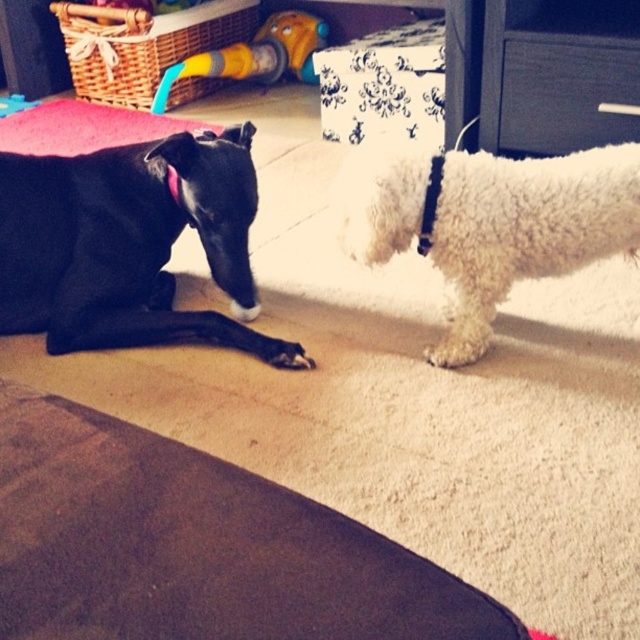
Looking at this image, can you confirm if white fluffy dog at right is positioned below pink fabric neckband at center?

Yes.

Does white fluffy dog at right lie in front of pink fabric neckband at center?

Yes, white fluffy dog at right is closer to the viewer.

Does point (372, 161) lie behind point (435, 198)?

No, it is not.

This screenshot has width=640, height=640. Find the location of `white fluffy dog at right`. white fluffy dog at right is located at coordinates (525, 228).

Is black plastic drawer at upper right shorter than black fabric neckband at left?

In fact, black plastic drawer at upper right may be taller than black fabric neckband at left.

Who is more forward, (618, 58) or (170, 180)?

Point (170, 180) is in front.

Where is `black plastic drawer at upper right`? black plastic drawer at upper right is located at coordinates (564, 93).

Is point (438, 176) positioned in front of point (176, 182)?

Yes.

Is pink fabric neckband at center thinner than black fabric neckband at left?

No.

Is point (436, 157) closer to camera compared to point (176, 189)?

Yes, point (436, 157) is closer to viewer.

This screenshot has width=640, height=640. In order to click on pink fabric neckband at center in this screenshot , I will do pyautogui.click(x=429, y=204).